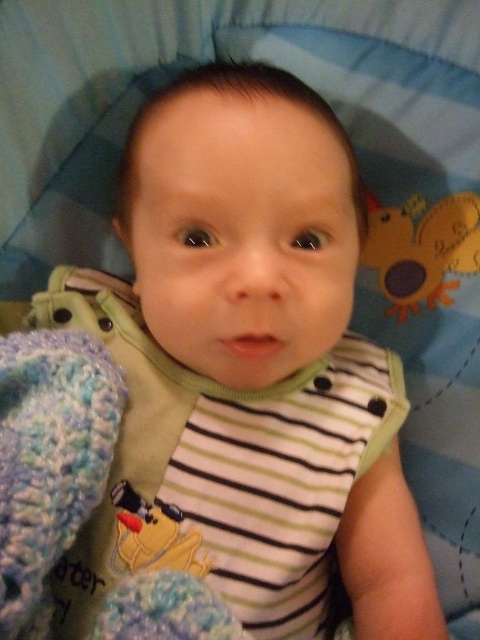
The baby is looking at two items in the scene. One is the matte yellow plush toy at upper right. The other item is a camera. Which of these two items is closer to the baby?

The matte yellow plush toy at upper right is closer to the baby than the camera because they are 26.05 inches apart from each other.

You are a parent trying to place a new toy for your baby. The baby is currently looking at the yellow plush duck at center. You want to place a new toy so it is closer to the baby than the existing matte yellow plush toy at upper right. Where should you place the new toy?

The new toy should be placed closer to the baby than the matte yellow plush toy at upper right, which is currently 37.80 centimeters away from the yellow plush duck at center. To ensure the new toy is closer, place it within less than 37.80 centimeters from the yellow plush duck at center.

What is located at the point marked by the coordinates (421, 250) in the image?

The point marked by the coordinates (421, 250) is the location of the matte yellow plush toy at upper right.